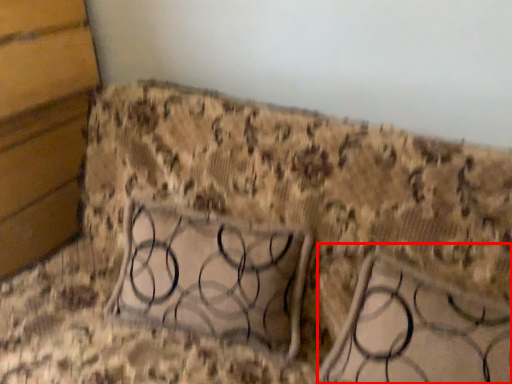
Question: From the image's perspective, what is the correct spatial positioning of furniture (annotated by the red box) in reference to panel?

Choices:
 (A) below
 (B) above

Answer: (A)